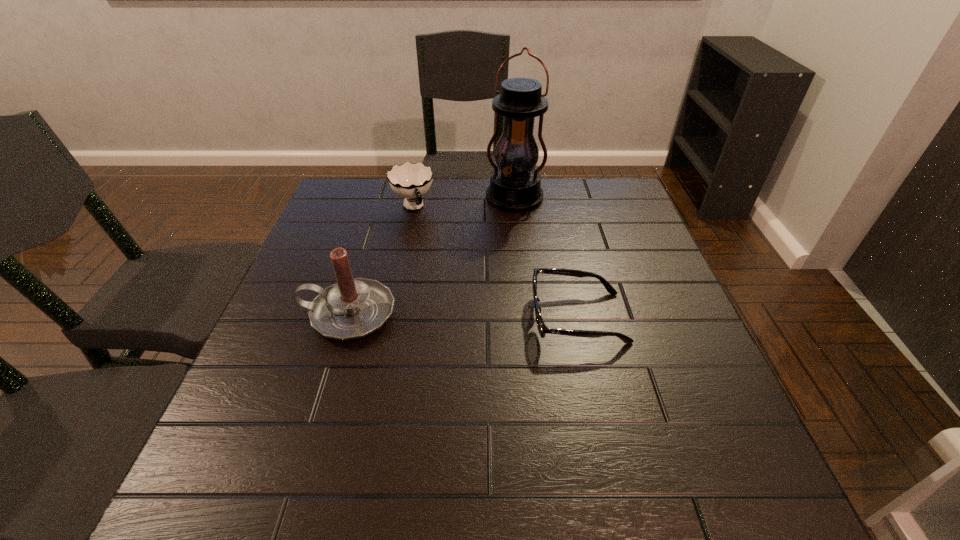
Find the location of a particular element. The image size is (960, 540). the second tallest object is located at coordinates (352, 308).

Where is `the shortest object`? This screenshot has height=540, width=960. the shortest object is located at coordinates (542, 328).

The image size is (960, 540). Identify the location of cup. (411, 181).

Identify the location of lantern. (515, 185).

At what (x,y) coordinates should I click in order to perform the action: click on vacant region located 0.050m on the side of the third shortest object with the handle loop. Please return your answer as a coordinate pair (x, y). Looking at the image, I should click on (280, 314).

Locate an element on the screen. This screenshot has height=540, width=960. vacant space situated 0.330m on the lenses of the shortest object is located at coordinates point(382,318).

You are a GUI agent. You are given a task and a screenshot of the screen. Output one action in this format:
    pyautogui.click(x=<x>, y=<y>)
    Task: Click on the vacant region located 0.250m on the lenses of the shortest object
    The height and width of the screenshot is (540, 960).
    Given the screenshot: What is the action you would take?
    tap(419, 318)

The image size is (960, 540). What are the coordinates of `free space located on the lenses of the shortest object` in the screenshot? It's located at (427, 318).

You are a GUI agent. You are given a task and a screenshot of the screen. Output one action in this format:
    pyautogui.click(x=<x>, y=<y>)
    Task: Click on the vacant area situated on the side of the third tallest object with the handle
    
    Given the screenshot: What is the action you would take?
    pyautogui.click(x=439, y=260)

Locate an element on the screen. The height and width of the screenshot is (540, 960). vacant point located on the side of the third tallest object with the handle is located at coordinates (433, 248).